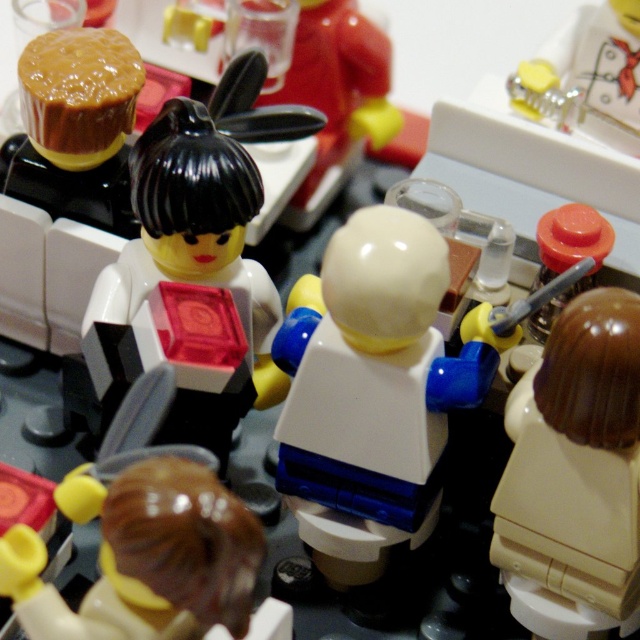
Can you confirm if translucent red cube at center is bigger than brown glossy hair at lower left?

Indeed, translucent red cube at center has a larger size compared to brown glossy hair at lower left.

Is translucent red cube at center in front of brown glossy hair at lower left?

No, translucent red cube at center is behind brown glossy hair at lower left.

This screenshot has height=640, width=640. What do you see at coordinates (186, 273) in the screenshot?
I see `translucent red cube at center` at bounding box center [186, 273].

At what (x,y) coordinates should I click in order to perform the action: click on translucent red cube at center. Please return your answer as a coordinate pair (x, y). This screenshot has height=640, width=640. Looking at the image, I should click on (186, 273).

Is white plastic figure at center closer to the viewer compared to black glossy minifigure at center?

Yes, it is.

Is point (394, 380) in front of point (314, 51)?

That is True.

The height and width of the screenshot is (640, 640). Find the location of `white plastic figure at center`. white plastic figure at center is located at coordinates (364, 394).

Can you confirm if white plastic figure at center is taller than brown glossy hair at center?

Indeed, white plastic figure at center has a greater height compared to brown glossy hair at center.

Between point (342, 340) and point (577, 632), which one is positioned behind?

Point (577, 632)

Which is behind, point (333, 545) or point (566, 536)?

Point (333, 545)

Find the location of `white plastic figure at center`. white plastic figure at center is located at coordinates (364, 394).